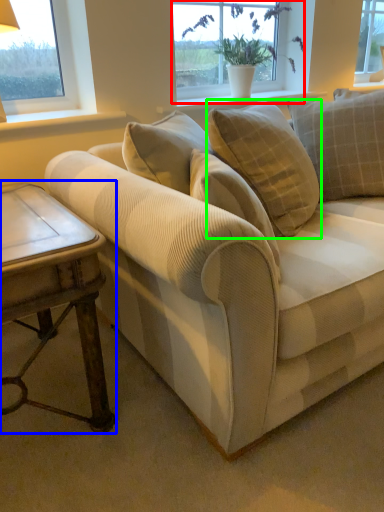
Question: Which object is the farthest from window (highlighted by a red box)? Choose among these: table (highlighted by a blue box) or pillow (highlighted by a green box).

Choices:
 (A) table
 (B) pillow

Answer: (A)